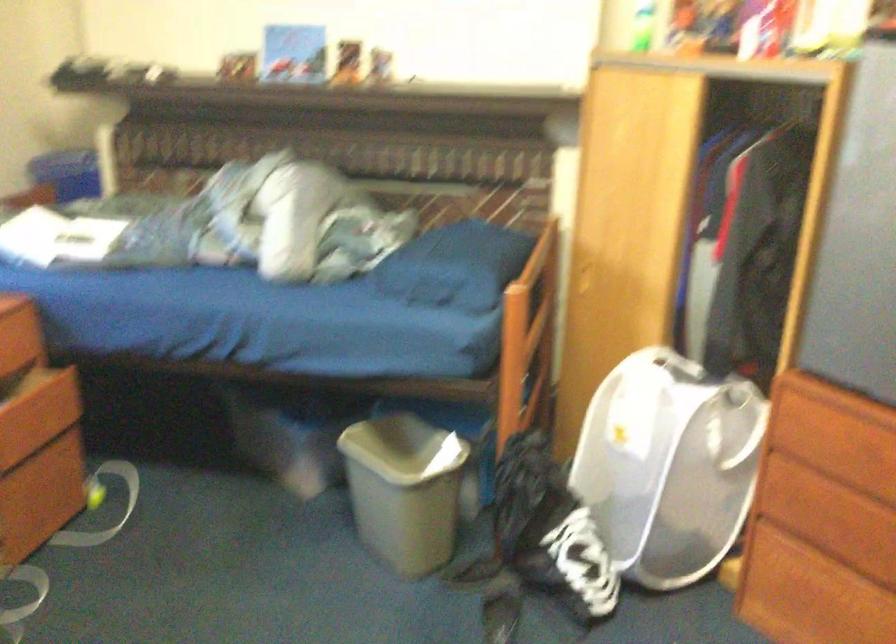
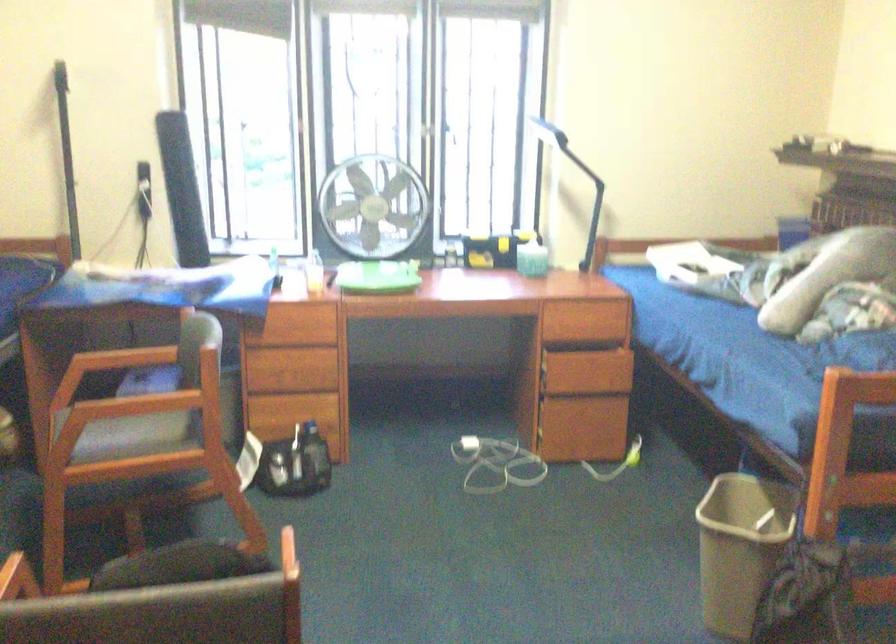
Where in the second image is the point corresponding to [166,238] from the first image?

(745, 275)